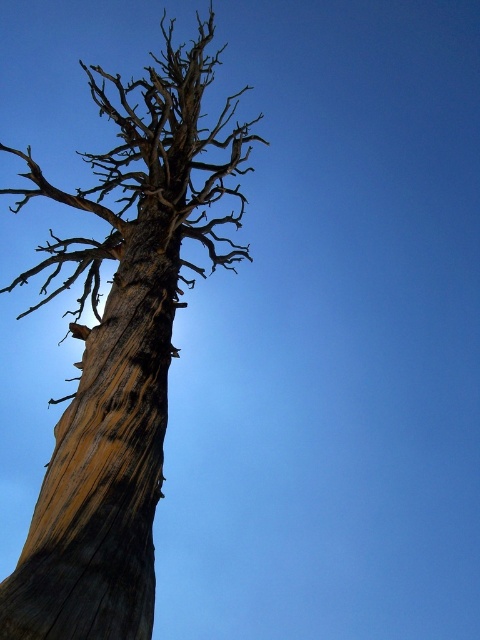
Question: Is weathered wood tree trunk at center in front of weathered wood tree trunk at left?

Choices:
 (A) no
 (B) yes

Answer: (A)

Question: Does weathered wood tree trunk at center appear under weathered wood tree trunk at left?

Choices:
 (A) no
 (B) yes

Answer: (A)

Question: Can you confirm if weathered wood tree trunk at center is positioned below weathered wood tree trunk at left?

Choices:
 (A) yes
 (B) no

Answer: (B)

Question: Which of the following is the farthest from the observer?

Choices:
 (A) weathered wood tree trunk at center
 (B) weathered wood tree trunk at left

Answer: (A)

Question: Which point is closer to the camera?

Choices:
 (A) (36, 506)
 (B) (205, 72)

Answer: (A)